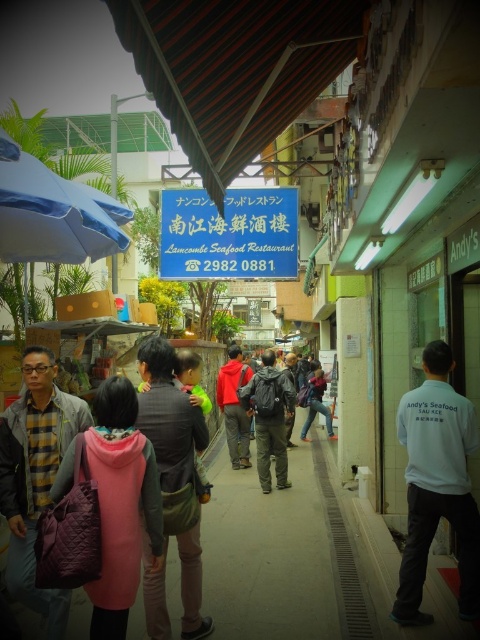
Between white cotton shirt at right and plaid fabric shirt at center, which one has more height?

plaid fabric shirt at center is taller.

Is point (471, 586) positioned behind point (68, 436)?

No, (471, 586) is closer to viewer.

Identify the location of white cotton shirt at right. This screenshot has width=480, height=640. (436, 484).

Which is in front, point (60, 424) or point (184, 584)?

Point (60, 424)

Can you confirm if plaid fabric shirt at center is shorter than matte gray jacket at center?

No, plaid fabric shirt at center is not shorter than matte gray jacket at center.

Between point (21, 497) and point (154, 396), which one is positioned in front?

Positioned in front is point (21, 497).

This screenshot has height=640, width=480. I want to click on plaid fabric shirt at center, so click(36, 476).

Can you confirm if blue plastic sign at center is shorter than blue fabric umbrella at left?

No, blue plastic sign at center is not shorter than blue fabric umbrella at left.

Is blue plastic sign at center in front of blue fabric umbrella at left?

No, blue plastic sign at center is behind blue fabric umbrella at left.

Is point (168, 276) positioned in front of point (3, 218)?

No, it is not.

You are a GUI agent. You are given a task and a screenshot of the screen. Output one action in this format:
    pyautogui.click(x=<x>, y=<y>)
    Task: Click on the blue plastic sign at center
    This screenshot has height=640, width=480.
    Given the screenshot: What is the action you would take?
    [x=228, y=234]